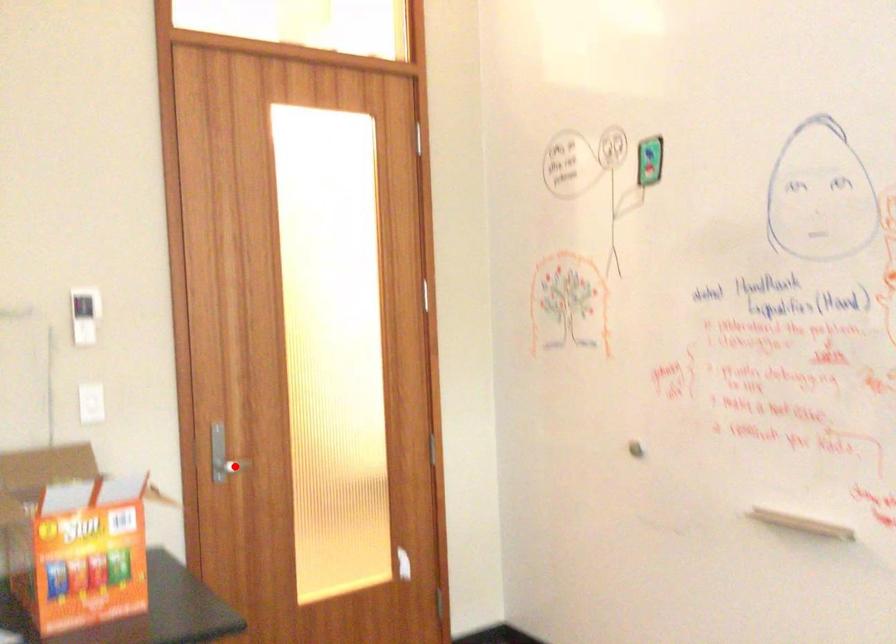
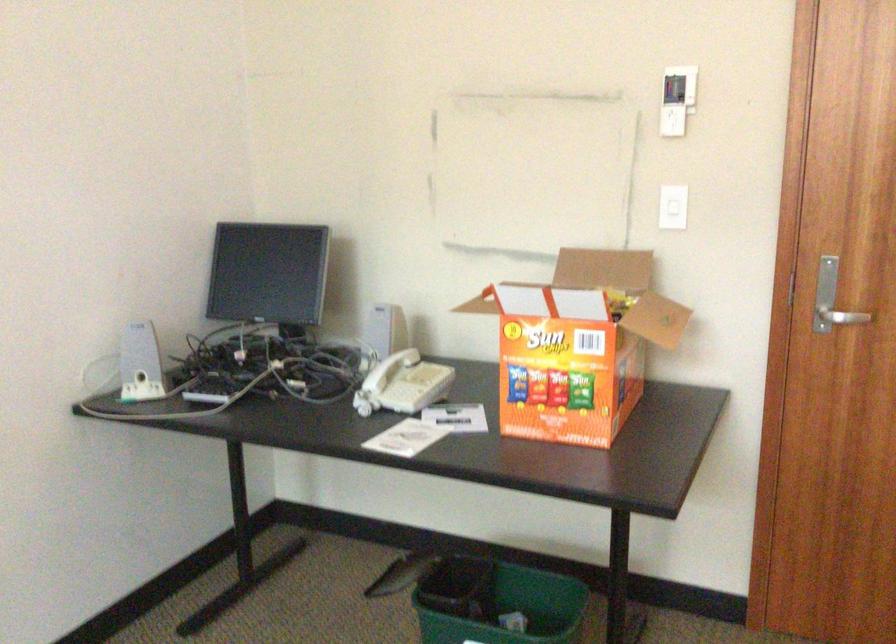
Where in the second image is the point corresponding to the highlighted location from the first image?

(842, 317)